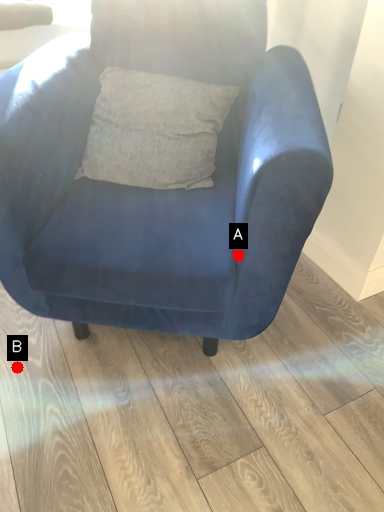
Question: Two points are circled on the image, labeled by A and B beside each circle. Among these points, which one is nearest to the camera?

Choices:
 (A) A is closer
 (B) B is closer

Answer: (A)